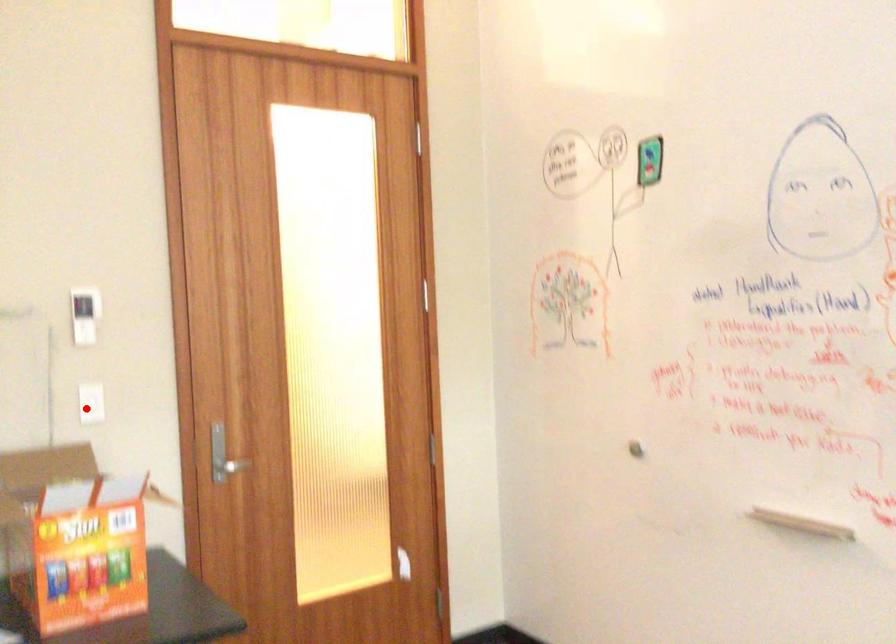
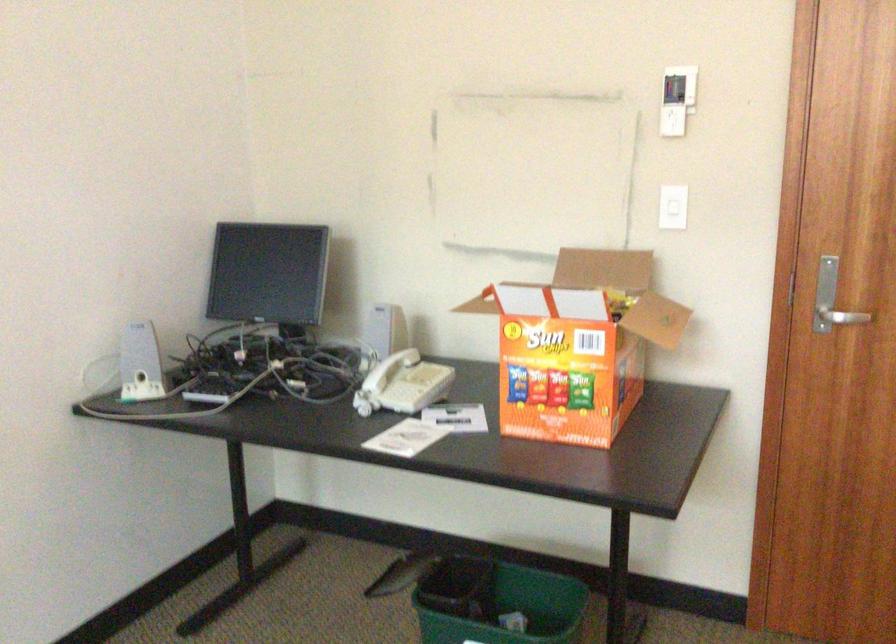
Question: A red point is marked in image1. In image2, is the corresponding 3D point closer to the camera or farther? Reply with the corresponding letter.

Choices:
 (A) The corresponding 3D point is closer.
 (B) The corresponding 3D point is farther.

Answer: (A)